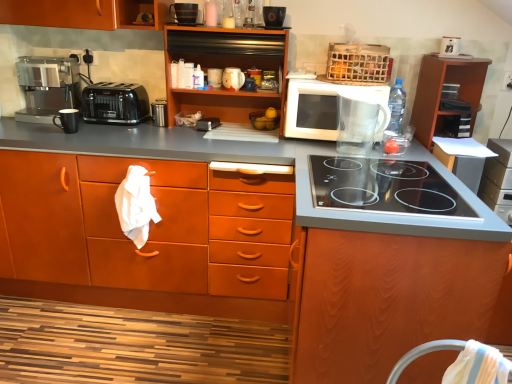
This screenshot has height=384, width=512. Identify the location of vacant space behind matte black mug at left, which appears as the 5th appliance when viewed from the right. (82, 124).